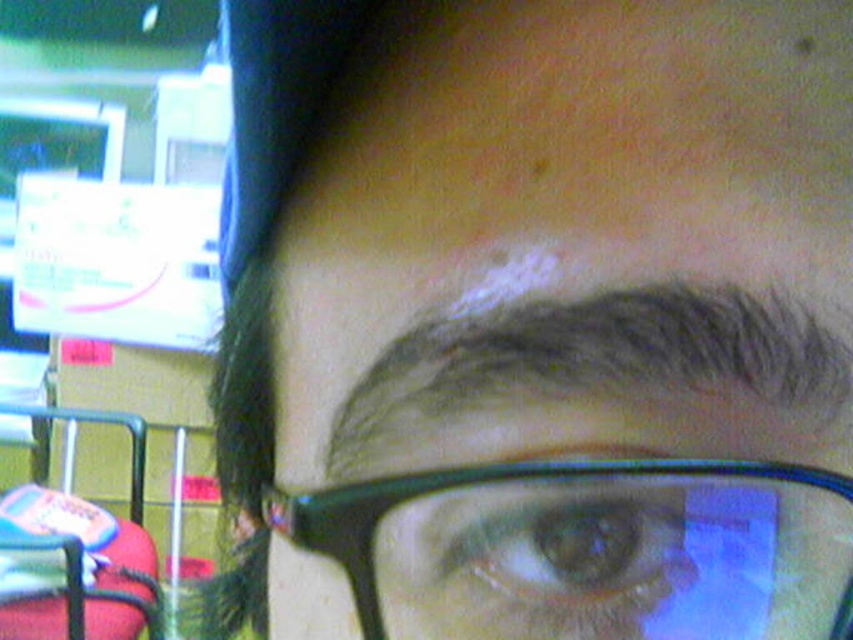
Between point (695, 554) and point (479, 570), which one is positioned behind?

The point (479, 570) is more distant.

Is black plastic glasses at center in front of brown matte eye at center?

That is True.

Between point (364, 497) and point (541, 493), which one is positioned behind?

The point (364, 497) is behind.

Where is `black plastic glasses at center`? The height and width of the screenshot is (640, 853). black plastic glasses at center is located at coordinates (589, 550).